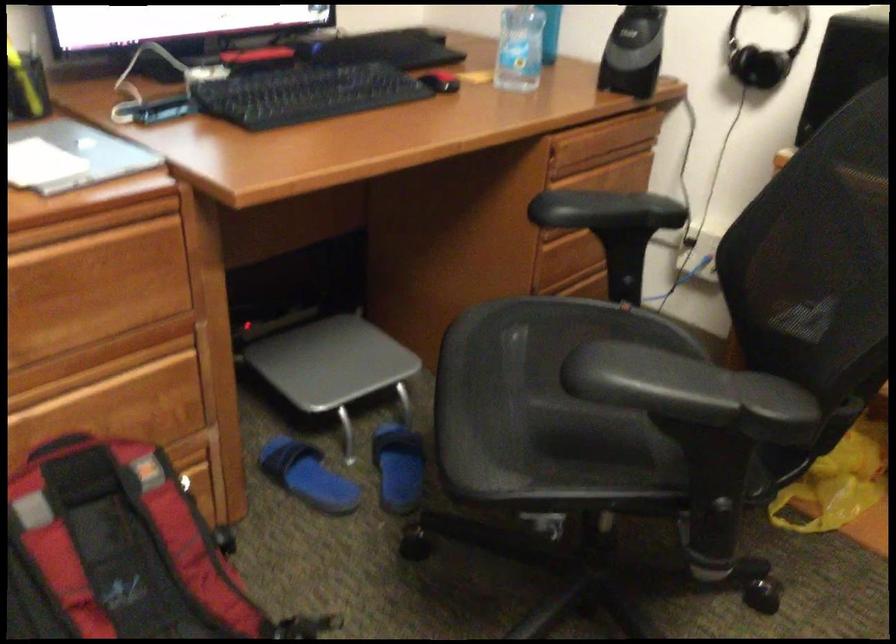
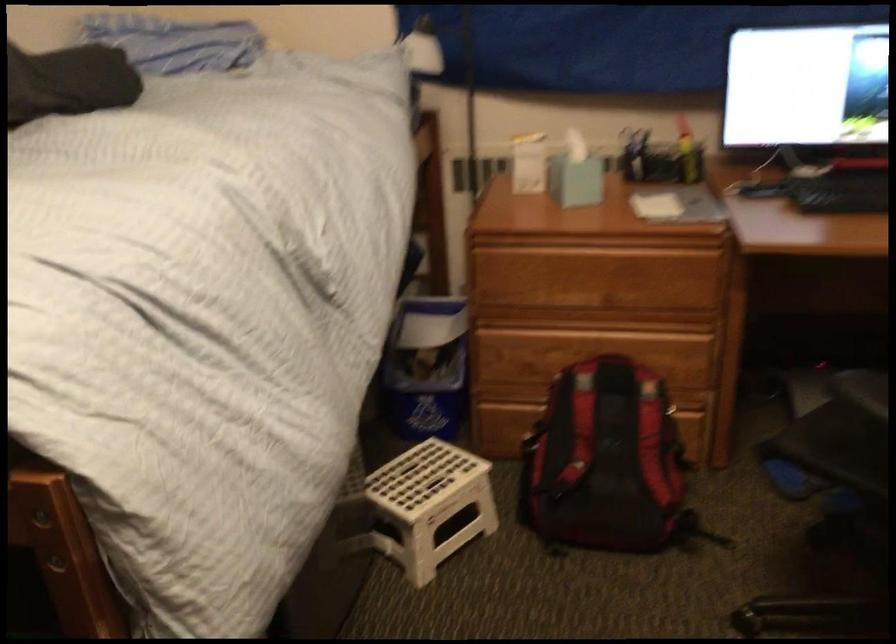
Question: The images are taken continuously from a first-person perspective. In which direction is your viewpoint rotating?

Choices:
 (A) Left
 (B) Right
 (C) Up
 (D) Down

Answer: (A)